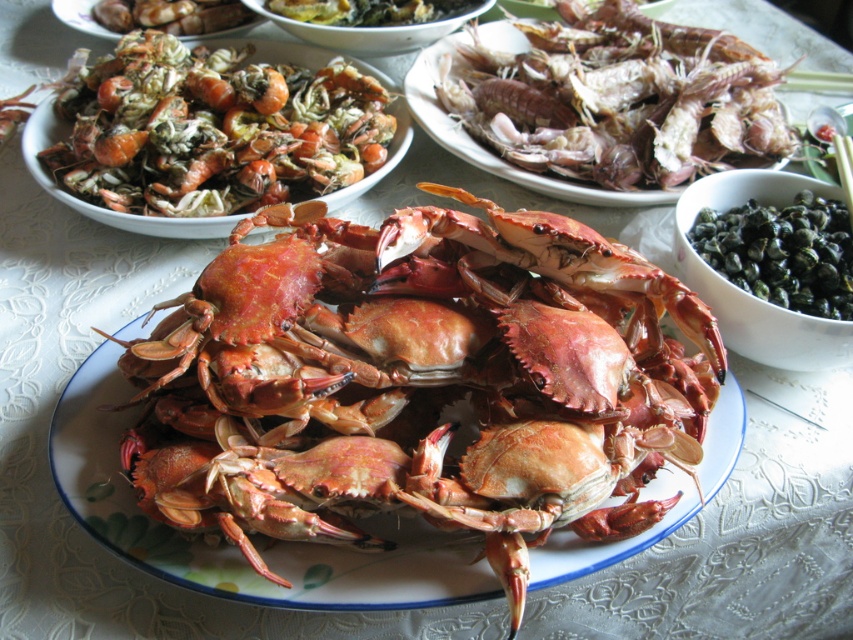
You are a food critic who needs to take a photo of the shiny brown crab at center and the green matte bowl at upper right. Since you want to emphasize their size difference, which object should you place closer to the camera?

To emphasize the size difference between the shiny brown crab at center and the green matte bowl at upper right, you should place the shiny brown crab at center closer to the camera because it is larger than the green matte bowl at upper right.

You are a food critic who needs to take a close photo of the shiny orange crab at upper left and the matte brown shells at upper left. Your camera can only focus on objects within a 12 inch range. Can you capture both in one shot without moving the camera?

The distance between the shiny orange crab at upper left and the matte brown shells at upper left is 13.10 inches. Since the camera can only focus within a 12 inch range, the two objects are slightly out of the camera focus range. Therefore, you cannot capture both in one shot without moving the camera.

You are a food critic sitting at a table with the shiny orange crab at upper left in front of you. You need to reach for your phone to take a photo of the crab. If your phone is on the table 0.8 meters away from the crab, can you comfortably reach it without moving your chair?

The shiny orange crab at upper left is 1.10 meters away from the viewer. Since the phone is only 0.8 meters away from the crab, the total distance from you to the phone would be 1.10 meters plus 0.8 meters, totaling 1.90 meters. Most people have an average reaching distance of about 1.5 to 1.8 meters. Therefore, you might need to adjust your position slightly to comfortably reach the phone.